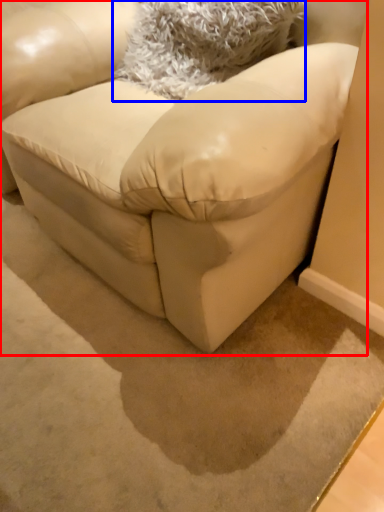
Question: Among these objects, which one is farthest to the camera, studio couch (highlighted by a red box) or throw pillow (highlighted by a blue box)?

Choices:
 (A) studio couch
 (B) throw pillow

Answer: (B)